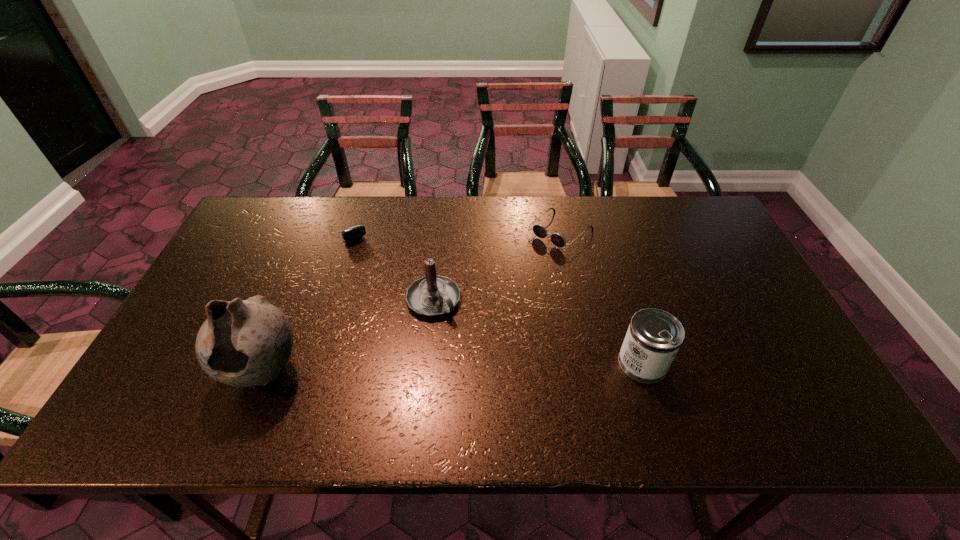
The height and width of the screenshot is (540, 960). In order to click on vacant space located 0.170m on the front-facing side of the webcam in this screenshot , I will do `click(375, 276)`.

You are a GUI agent. You are given a task and a screenshot of the screen. Output one action in this format:
    pyautogui.click(x=<x>, y=<y>)
    Task: Click on the free location located on the front-facing side of the webcam
    The image size is (960, 540).
    Given the screenshot: What is the action you would take?
    pyautogui.click(x=389, y=298)

Identify the location of free space located on the front-facing side of the webcam. Image resolution: width=960 pixels, height=540 pixels. (385, 291).

The image size is (960, 540). In order to click on free spot located 0.180m on the side of the candle with the handle loop in this screenshot , I will do `click(490, 364)`.

Image resolution: width=960 pixels, height=540 pixels. I want to click on vacant space situated on the side of the candle with the handle loop, so click(497, 372).

Where is `vacant space located on the side of the candle with the handle loop`? The height and width of the screenshot is (540, 960). vacant space located on the side of the candle with the handle loop is located at coordinates (511, 387).

Where is `sunglasses positioned at the far edge`? The image size is (960, 540). sunglasses positioned at the far edge is located at coordinates (540, 231).

Identify the location of webcam located at the far edge. The width and height of the screenshot is (960, 540). (353, 233).

At what (x,y) coordinates should I click in order to perform the action: click on pottery at the near edge. Please return your answer as a coordinate pair (x, y). This screenshot has width=960, height=540. Looking at the image, I should click on (243, 343).

I want to click on can located at the near edge, so click(654, 336).